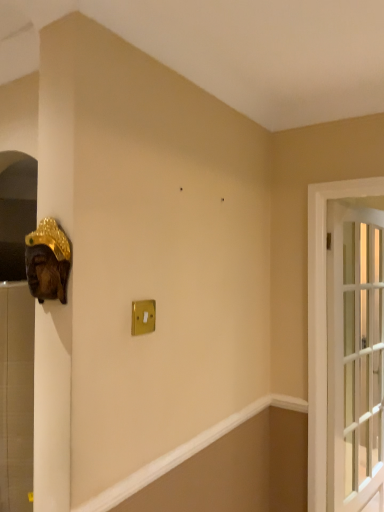
Question: Is wooden mask at left bigger or smaller than clear glass door at right?

Choices:
 (A) big
 (B) small

Answer: (B)

Question: From a real-world perspective, is wooden mask at left physically located above or below clear glass door at right?

Choices:
 (A) above
 (B) below

Answer: (A)

Question: Which is nearer to the clear glass door at right?

Choices:
 (A) wooden mask at left
 (B) gold metallic light switch at center

Answer: (B)

Question: Which is farther from the clear glass door at right?

Choices:
 (A) gold metallic light switch at center
 (B) wooden mask at left

Answer: (B)